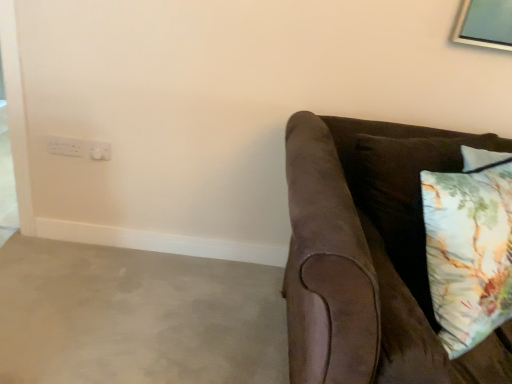
Question: Should I look upward or downward to see suede brown couch at right?

Choices:
 (A) down
 (B) up

Answer: (A)

Question: From the image's perspective, is floral cotton pillow at right on white plastic electric outlet at upper left, positioned as the second electric outlet in left-to-right order?

Choices:
 (A) no
 (B) yes

Answer: (A)

Question: Is floral cotton pillow at right at the right side of white plastic electric outlet at upper left, positioned as the second electric outlet in left-to-right order?

Choices:
 (A) yes
 (B) no

Answer: (A)

Question: From a real-world perspective, is floral cotton pillow at right beneath white plastic electric outlet at upper left, the first electric outlet viewed from the right?

Choices:
 (A) no
 (B) yes

Answer: (A)

Question: Is floral cotton pillow at right positioned with its back to white plastic electric outlet at upper left, the first electric outlet viewed from the right?

Choices:
 (A) yes
 (B) no

Answer: (A)

Question: Is floral cotton pillow at right positioned behind white plastic electric outlet at upper left, positioned as the second electric outlet in left-to-right order?

Choices:
 (A) yes
 (B) no

Answer: (B)

Question: From a real-world perspective, does floral cotton pillow at right stand above white plastic electric outlet at upper left, positioned as the second electric outlet in left-to-right order?

Choices:
 (A) no
 (B) yes

Answer: (B)

Question: Is white plastic electrical outlet at upper left, the 1th electric outlet in the left-to-right sequence, aimed at suede brown couch at right?

Choices:
 (A) no
 (B) yes

Answer: (A)

Question: Can you confirm if white plastic electrical outlet at upper left, the 1th electric outlet in the left-to-right sequence, is shorter than suede brown couch at right?

Choices:
 (A) no
 (B) yes

Answer: (B)

Question: Does white plastic electrical outlet at upper left, the 1th electric outlet in the left-to-right sequence, lie in front of suede brown couch at right?

Choices:
 (A) yes
 (B) no

Answer: (B)

Question: Can you confirm if white plastic electrical outlet at upper left, the 1th electric outlet in the left-to-right sequence, is bigger than suede brown couch at right?

Choices:
 (A) yes
 (B) no

Answer: (B)

Question: From the image's perspective, would you say white plastic electrical outlet at upper left, the 1th electric outlet in the left-to-right sequence, is shown under suede brown couch at right?

Choices:
 (A) no
 (B) yes

Answer: (A)

Question: Considering the relative positions of white plastic electrical outlet at upper left, the second electric outlet viewed from the right, and suede brown couch at right in the image provided, is white plastic electrical outlet at upper left, the second electric outlet viewed from the right, to the left of suede brown couch at right from the viewer's perspective?

Choices:
 (A) yes
 (B) no

Answer: (A)

Question: Could you tell me if suede brown couch at right is turned towards white plastic electric outlet at upper left, the first electric outlet viewed from the right?

Choices:
 (A) yes
 (B) no

Answer: (B)